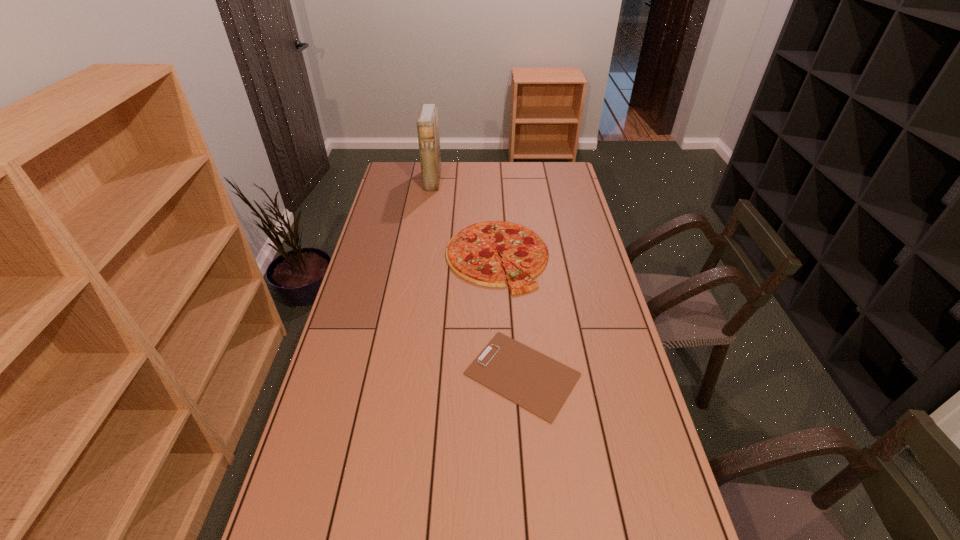
Find the location of `the leftmost object`. the leftmost object is located at coordinates (x=427, y=123).

Identify the location of the tallest object. (427, 123).

What are the coordinates of `pizza` in the screenshot? It's located at click(x=472, y=253).

Locate an element on the screen. This screenshot has height=540, width=960. the second tallest object is located at coordinates (472, 253).

Identify the location of the nearest object. Image resolution: width=960 pixels, height=540 pixels. (530, 379).

Locate an element on the screen. The height and width of the screenshot is (540, 960). clipboard is located at coordinates (530, 379).

Image resolution: width=960 pixels, height=540 pixels. Find the location of `vacant space located 0.350m on the cover of the phonebook`. vacant space located 0.350m on the cover of the phonebook is located at coordinates pyautogui.click(x=512, y=180).

The width and height of the screenshot is (960, 540). Find the location of `vacant space located 0.280m on the front of the second tallest object`. vacant space located 0.280m on the front of the second tallest object is located at coordinates (502, 360).

Locate an element on the screen. vacant space located on the back of the clipboard is located at coordinates (517, 317).

At what (x,y) coordinates should I click in order to perform the action: click on object located in the far edge section of the desktop. Please return your answer as a coordinate pair (x, y). The image size is (960, 540). Looking at the image, I should click on (427, 123).